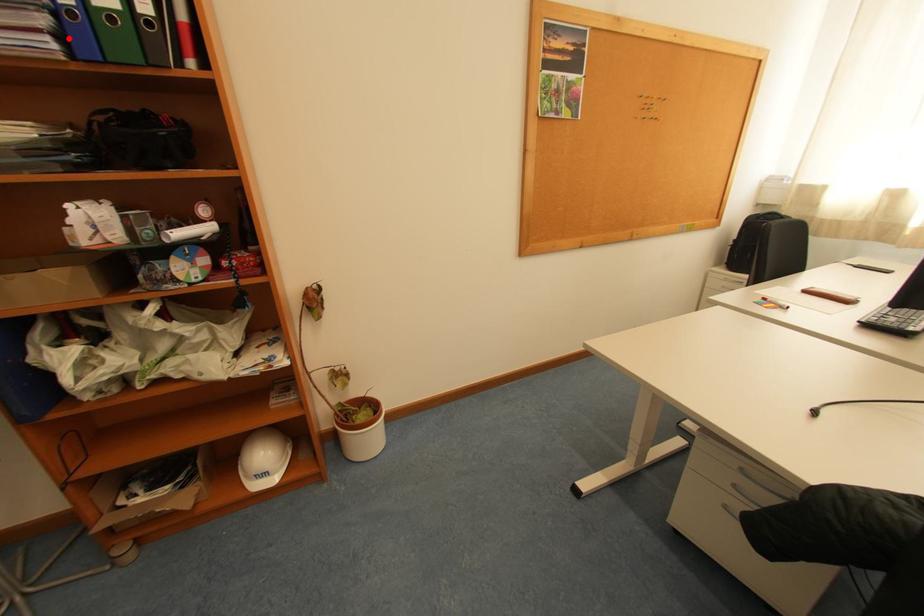
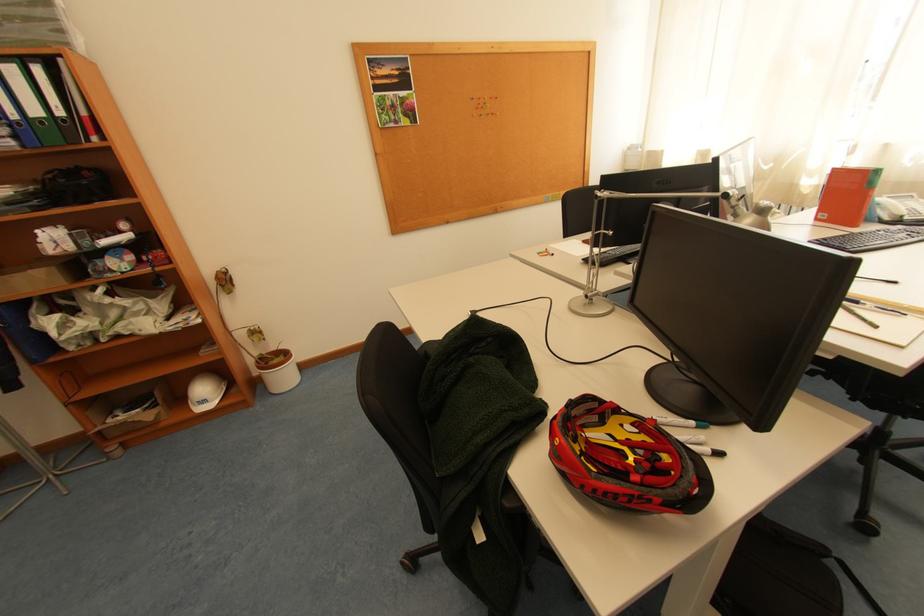
Locate, in the second image, the point that corresponds to the highlighted location in the first image.

(23, 139)